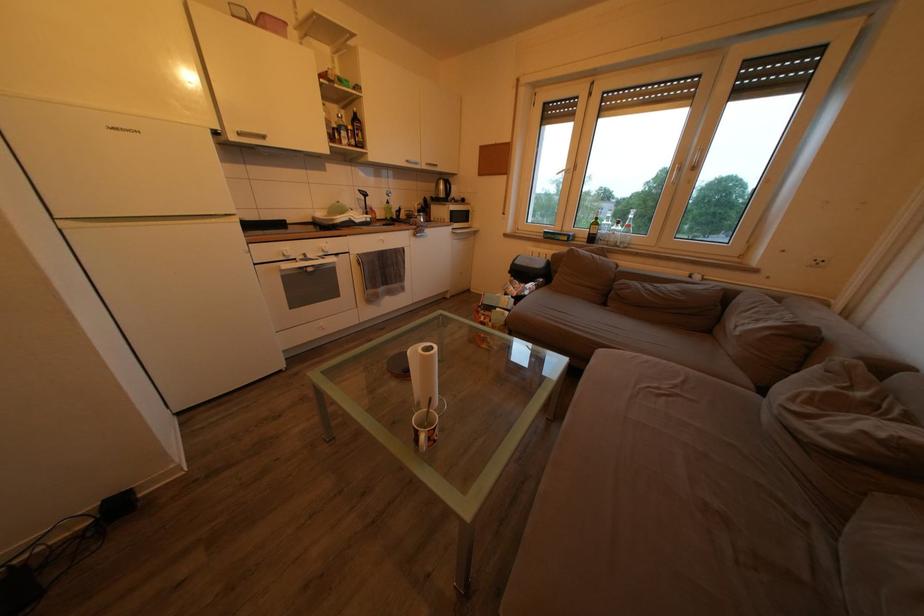
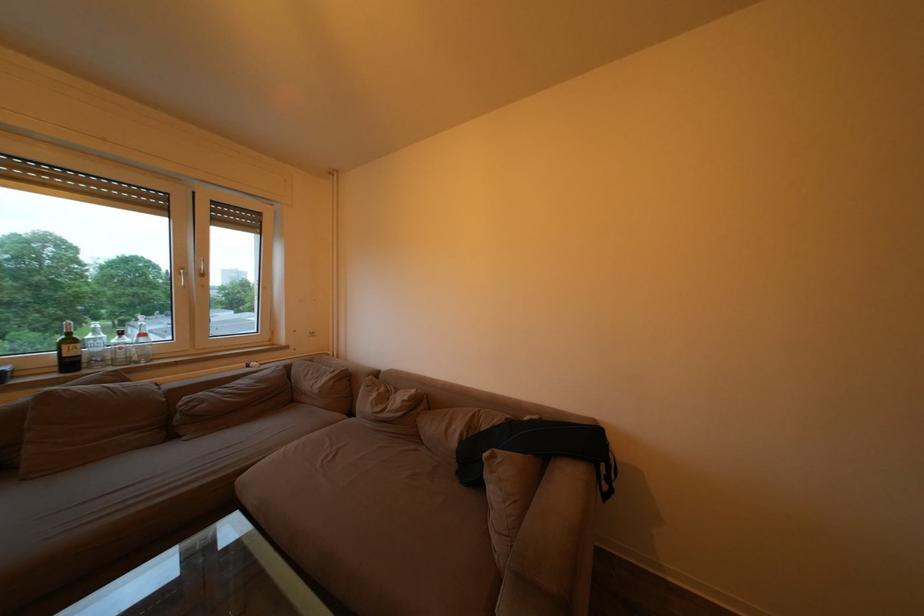
The point at (x=612, y=310) is marked in the first image. Where is the corresponding point in the second image?

(178, 443)